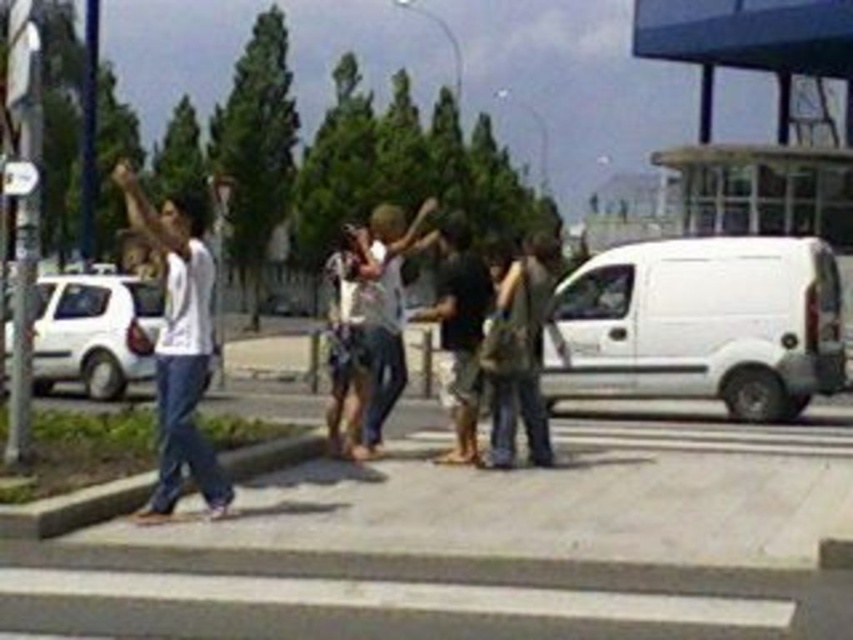
Question: Is light brown leather jacket at center to the right of gray concrete curb at lower left from the viewer's perspective?

Choices:
 (A) no
 (B) yes

Answer: (B)

Question: Does gray concrete pavement at center have a smaller size compared to gray concrete curb at lower left?

Choices:
 (A) yes
 (B) no

Answer: (B)

Question: Is white matte shirt at left positioned behind white matte hatchback at left?

Choices:
 (A) no
 (B) yes

Answer: (A)

Question: Estimate the real-world distances between objects in this image. Which object is farther from the white matte hatchback at left?

Choices:
 (A) white matte van at right
 (B) light brown leather jacket at center
 (C) camouflage fabric shirt at center

Answer: (B)

Question: Which object appears farthest from the camera in this image?

Choices:
 (A) camouflage fabric shirt at center
 (B) light brown leather jacket at center

Answer: (A)

Question: Which point is closer to the camera?

Choices:
 (A) (392, 230)
 (B) (541, 333)

Answer: (A)